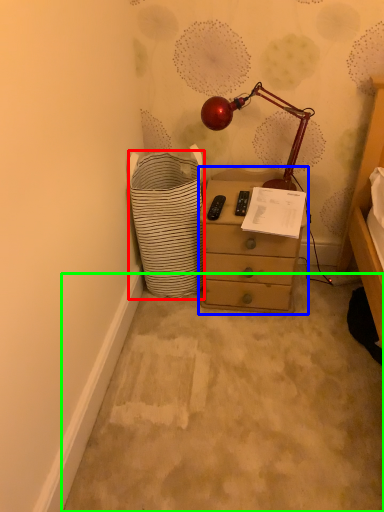
Question: Considering the real-world distances, which object is closest to shopping basket (highlighted by a red box)? chest of drawers (highlighted by a blue box) or concrete (highlighted by a green box).

Choices:
 (A) chest of drawers
 (B) concrete

Answer: (A)